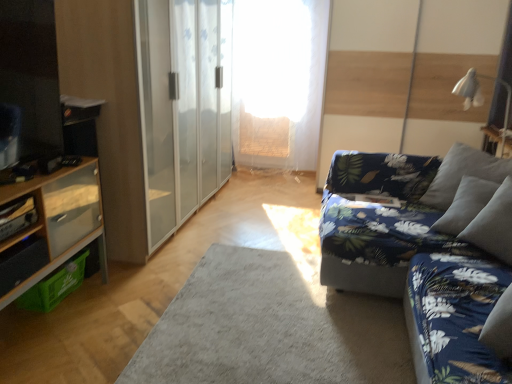
Question: Considering the positions of blue floral fabric couch at right and transparent glass barn door at center in the image, is blue floral fabric couch at right bigger or smaller than transparent glass barn door at center?

Choices:
 (A) small
 (B) big

Answer: (B)

Question: From a real-world perspective, is blue floral fabric couch at right physically located above or below transparent glass barn door at center?

Choices:
 (A) below
 (B) above

Answer: (A)

Question: Based on their relative distances, which object is nearer to the wooden shelf at left?

Choices:
 (A) white fabric lampshade at upper right
 (B) blue floral fabric couch at right
 (C) wooden cabinet at left
 (D) transparent glass barn door at center
 (E) transparent fabric at center

Answer: (C)

Question: Which object is the farthest from the gray soft rug at center?

Choices:
 (A) blue floral fabric couch at right
 (B) wooden shelf at left
 (C) transparent fabric at center
 (D) wooden cabinet at left
 (E) white fabric lampshade at upper right

Answer: (C)